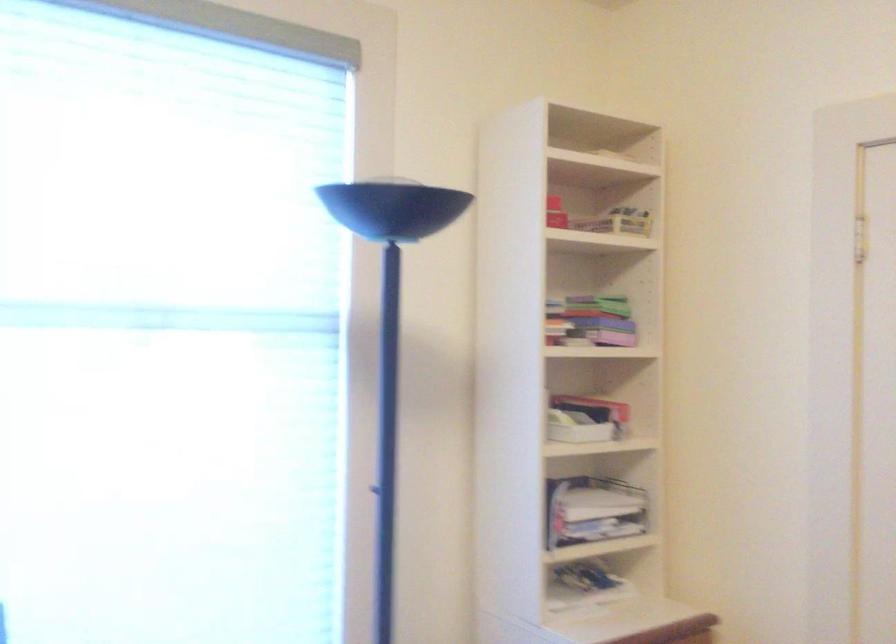
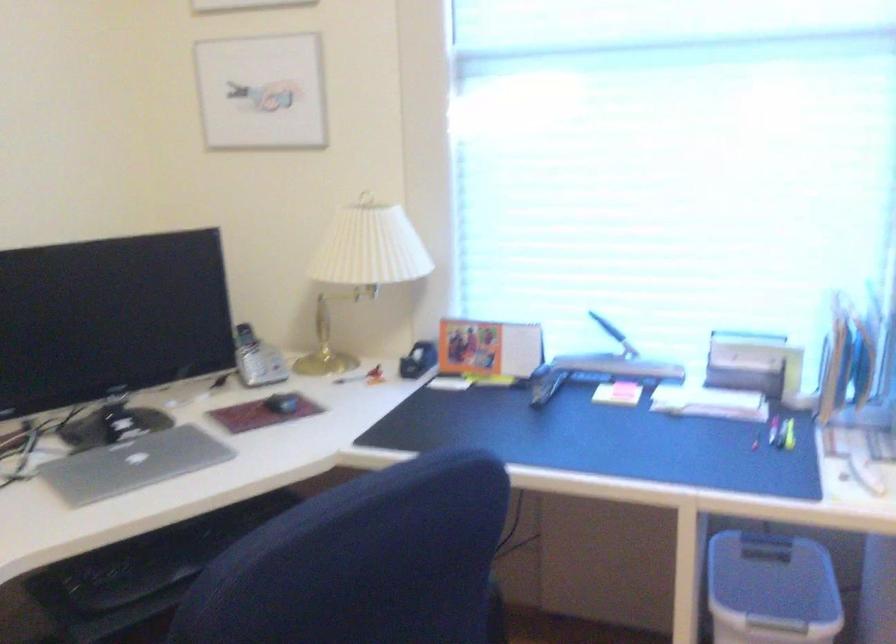
Question: How did the camera likely rotate?

Choices:
 (A) Left
 (B) Right
 (C) Up
 (D) Down

Answer: (A)